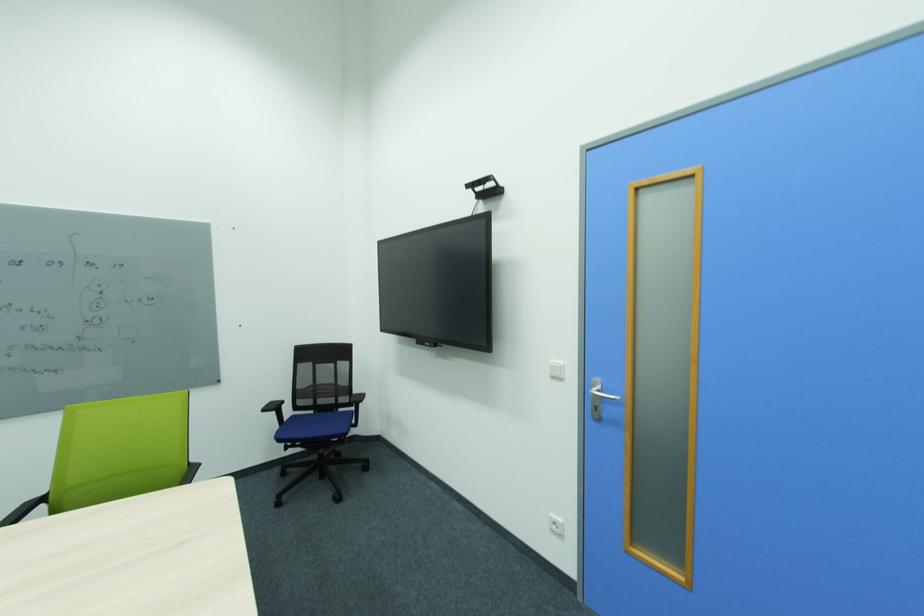
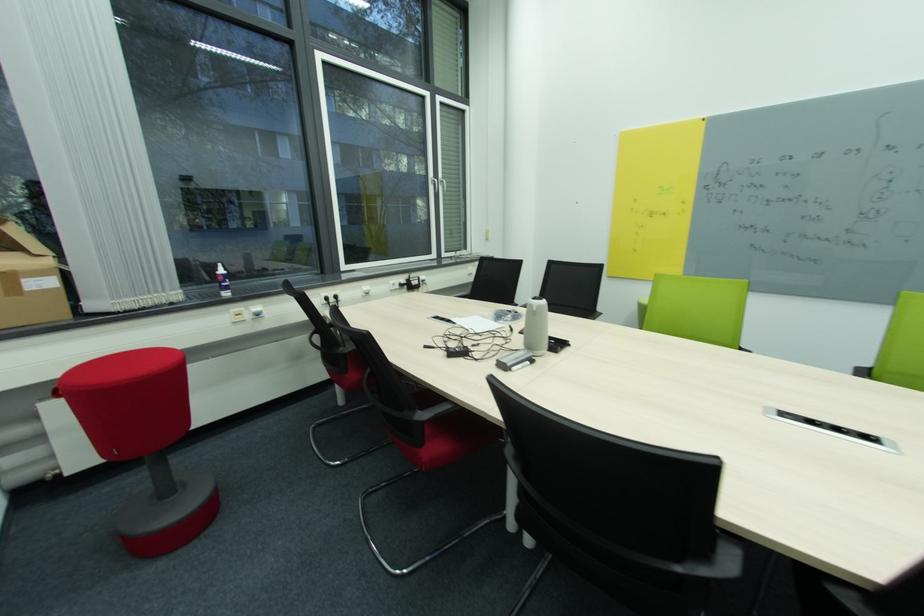
How did the camera likely rotate?

The rotation direction of the camera is left-down.